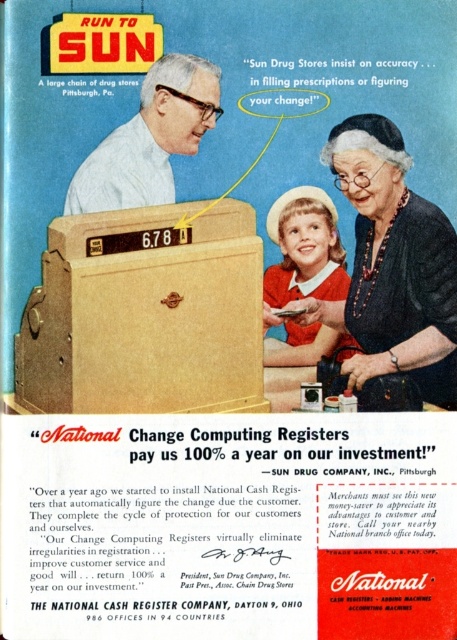
Question: Which is nearer to the matte white shirt at center?

Choices:
 (A) wooden box at center
 (B) matte black dress at center

Answer: (A)

Question: Does wooden box at center have a greater width compared to matte white shirt at center?

Choices:
 (A) yes
 (B) no

Answer: (A)

Question: Can you confirm if wooden box at center is positioned above matte black dress at center?

Choices:
 (A) yes
 (B) no

Answer: (B)

Question: Observing the image, what is the correct spatial positioning of wooden box at center in reference to matte white shirt at center?

Choices:
 (A) left
 (B) right

Answer: (A)

Question: Which object appears closest to the camera in this image?

Choices:
 (A) matte black dress at center
 (B) wooden box at center
 (C) matte white shirt at center

Answer: (B)

Question: Among these objects, which one is nearest to the camera?

Choices:
 (A) matte black dress at center
 (B) matte white shirt at center

Answer: (B)